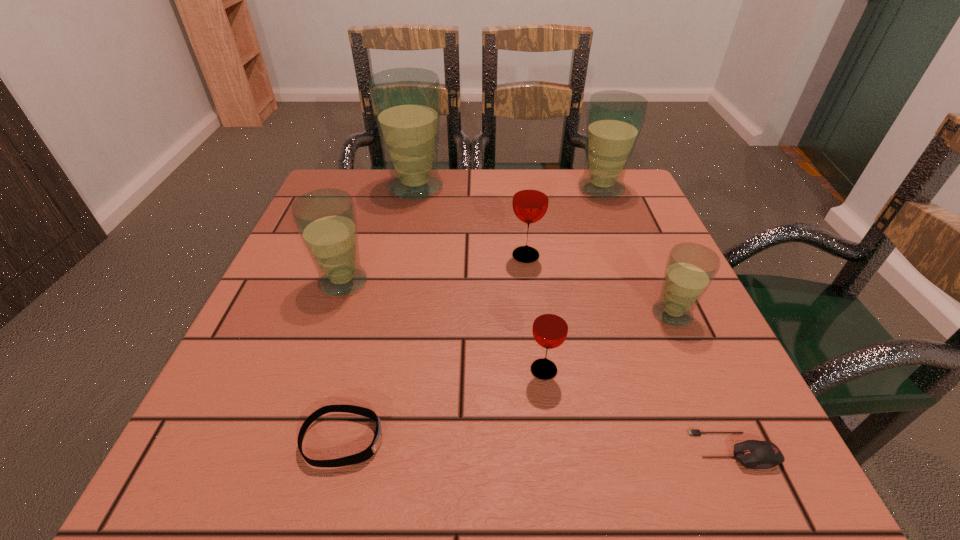
Where is `empty location between the wristband and the tallest object`? The height and width of the screenshot is (540, 960). empty location between the wristband and the tallest object is located at coordinates (379, 313).

Where is `free space between the bigger red glass and the mouse`? The width and height of the screenshot is (960, 540). free space between the bigger red glass and the mouse is located at coordinates (631, 353).

Image resolution: width=960 pixels, height=540 pixels. Find the location of `vacant area that lies between the second smallest blue glass and the nearer red glass`. vacant area that lies between the second smallest blue glass and the nearer red glass is located at coordinates (444, 326).

I want to click on blank region between the second biggest blue glass and the second smallest blue glass, so click(x=472, y=235).

Identify the location of object that is the second closest to the second biggest blue glass. The height and width of the screenshot is (540, 960). (406, 102).

Where is `the seventh closest object relative to the nearer red glass`? the seventh closest object relative to the nearer red glass is located at coordinates (406, 102).

Identify the location of glass object that ranks as the closest to the third biggest blue glass. (406, 102).

The image size is (960, 540). Identify the location of glass that is the sixth closest to the mouse. (x=406, y=102).

Identify which blue glass is the closest to the smallest blue glass. Please provide its 2D coordinates. Your answer should be formatted as a tuple, i.e. [(x, y)], where the tuple contains the x and y coordinates of a point satisfying the conditions above.

[(615, 118)]

What are the coordinates of `blue glass that is the second nearest to the third biggest blue glass` in the screenshot? It's located at (615, 118).